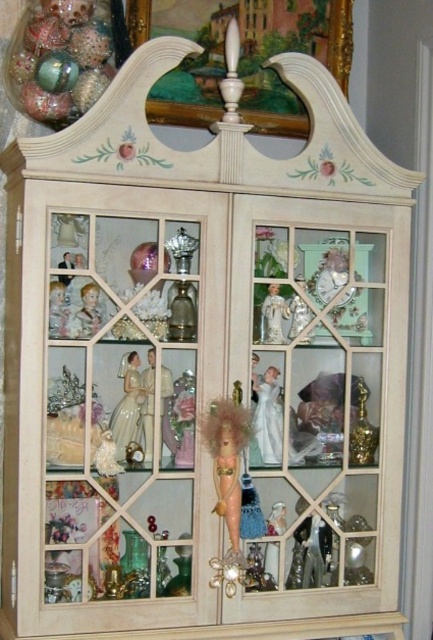
You are standing in front of the decorative display cabinet and want to place a new miniature vase exactly where the shiny gold doll at center is currently positioned. Is there enough space to do this without moving the doll?

The shiny gold doll at center is located at point (226, 458), so there is no space to place the new miniature vase without moving the doll since it occupies that exact position.